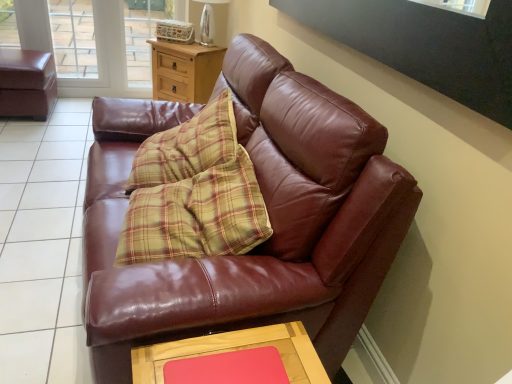
Question: Is transparent glass window at upper left spatially inside transparent glass screen door at upper left, or outside of it?

Choices:
 (A) outside
 (B) inside

Answer: (A)

Question: Looking at their shapes, would you say transparent glass window at upper left is wider or thinner than transparent glass screen door at upper left?

Choices:
 (A) wide
 (B) thin

Answer: (A)

Question: Which is farther from the rubberized pink mat at lower center?

Choices:
 (A) yellow plaid pillow at center
 (B) leather swivel chair at left
 (C) shiny brown leather couch at center
 (D) clear glass lamp at upper center
 (E) wooden table at lower center

Answer: (B)

Question: Which is nearer to the yellow plaid pillow at center?

Choices:
 (A) wooden table at lower center
 (B) leather swivel chair at left
 (C) woodenside table at upper center
 (D) transparent glass window at upper left
 (E) rubberized pink mat at lower center

Answer: (A)